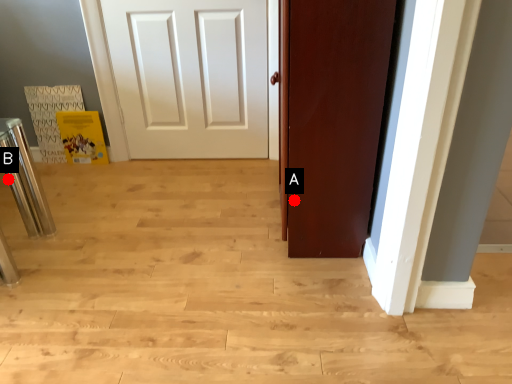
Question: Two points are circled on the image, labeled by A and B beside each circle. Which point is farther from the camera taking this photo?

Choices:
 (A) A is further
 (B) B is further

Answer: (B)